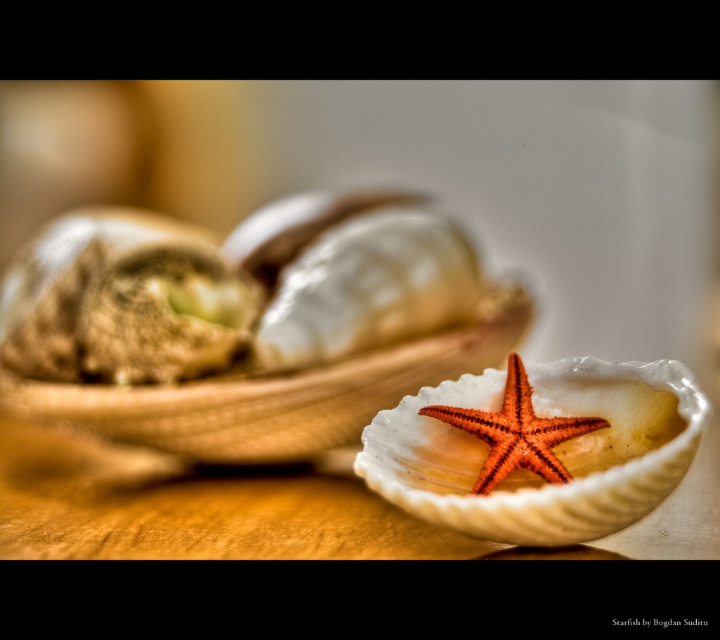
Based on the coordinates provided in the description, where is the white matte shellfish at center located?

The white matte shellfish at center is located at point (243, 328).

Where is the white matte shellfish at center located in the image?

The white matte shellfish at center is located at point (243, 328).

You are a marine biologist examining the image. You notice the white matte shellfish at center and the orange matte starfish at center. Which object is located above the other?

The white matte shellfish at center is positioned over the orange matte starfish at center, so it is above it.